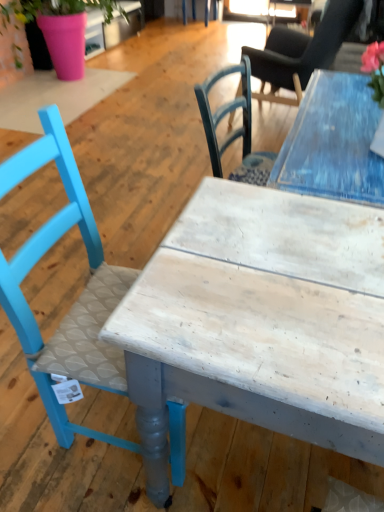
Locate an element on the screen. empty space that is ontop of white wood table at center (from a real-world perspective) is located at coordinates (282, 267).